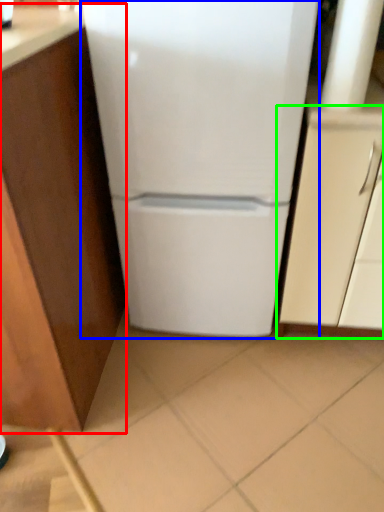
Question: Which object is the closest to the cabinetry (highlighted by a red box)? Choose among these: refrigerator (highlighted by a blue box) or cabinetry (highlighted by a green box).

Choices:
 (A) refrigerator
 (B) cabinetry

Answer: (A)